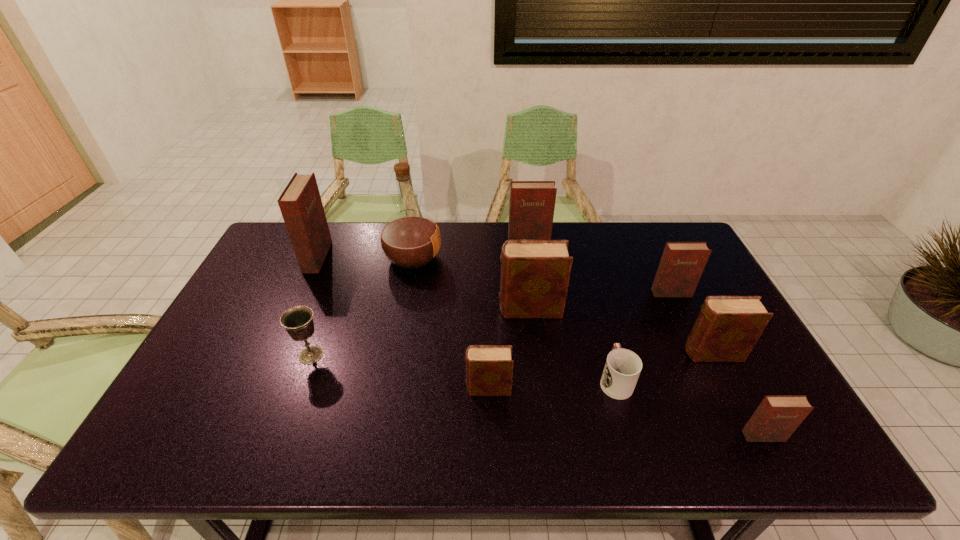
The width and height of the screenshot is (960, 540). I want to click on free point located 0.300m on the spine side of the smallest brown diary, so click(x=345, y=388).

You are a GUI agent. You are given a task and a screenshot of the screen. Output one action in this format:
    pyautogui.click(x=<x>, y=<y>)
    Task: Click on the free spot located 0.180m on the spine side of the smallest brown diary
    The height and width of the screenshot is (540, 960).
    Given the screenshot: What is the action you would take?
    pyautogui.click(x=393, y=388)

Where is `free space located 0.200m on the spine side of the smallest brown diary`? The image size is (960, 540). free space located 0.200m on the spine side of the smallest brown diary is located at coordinates (385, 388).

The height and width of the screenshot is (540, 960). What are the coordinates of `free spot located 0.140m on the side of the shortest object where the handle is located` in the screenshot? It's located at (599, 322).

The width and height of the screenshot is (960, 540). In order to click on free spot located 0.380m on the side of the shortest object where the handle is located in this screenshot , I will do pos(585,268).

This screenshot has height=540, width=960. What are the coordinates of `vacant space located on the side of the shortest object where the handle is located` in the screenshot? It's located at (590, 292).

Find the location of `liquor present at the far edge`. liquor present at the far edge is located at coordinates (410, 239).

Find the location of a particular element. object present at the near edge is located at coordinates (776, 418).

At what (x,y) coordinates should I click in order to perform the action: click on object that is at the left edge. Please return your answer as a coordinate pair (x, y). Looking at the image, I should click on (300, 203).

I want to click on object at the far left corner, so click(x=300, y=203).